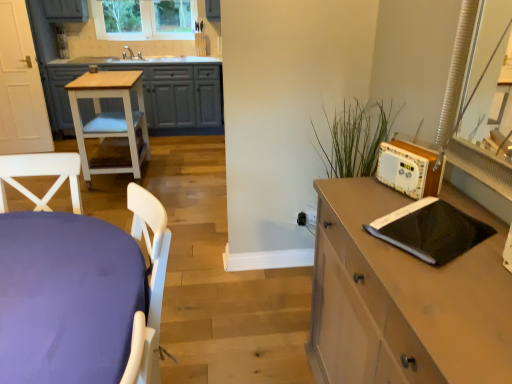
Question: From the image's perspective, relative to clear glass window at upper center, is white painted wood cabinet at left above or below?

Choices:
 (A) below
 (B) above

Answer: (A)

Question: In terms of size, does white painted wood cabinet at left appear bigger or smaller than clear glass window at upper center?

Choices:
 (A) small
 (B) big

Answer: (B)

Question: Which object is the closest to the clear glass window at upper center?

Choices:
 (A) black matte notebook at right
 (B) purple fabric table at lower left
 (C) light wood/white painted stool at left
 (D) wooden radio at right
 (E) white painted wood cabinet at left

Answer: (E)

Question: Estimate the real-world distances between objects in this image. Which object is farther from the black matte notebook at right?

Choices:
 (A) clear glass window at upper center
 (B) wooden radio at right
 (C) light wood/white painted stool at left
 (D) white painted wood cabinet at left
 (E) purple fabric table at lower left

Answer: (A)